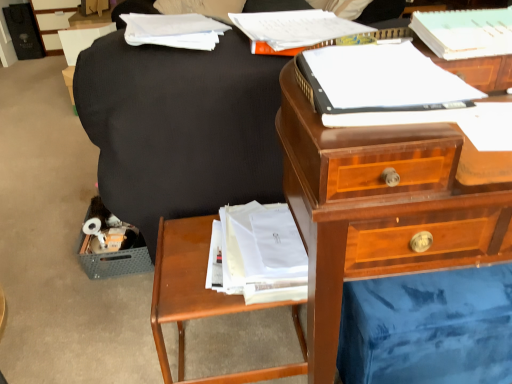
Question: Does point (147, 26) appear closer or farther from the camera than point (47, 6)?

Choices:
 (A) farther
 (B) closer

Answer: (B)

Question: Based on their positions, is white paper at upper left located to the left or right of matte black file cabinet at upper left?

Choices:
 (A) right
 (B) left

Answer: (A)

Question: Which of these objects is positioned closest to the matte black file cabinet at upper left?

Choices:
 (A) matte black swivel chair at center
 (B) light green paper at upper right, the second paperback book in the front-to-back sequence
 (C) wooden nightstand at lower left
 (D) white paper at upper left
 (E) white paper at upper center, marked as the 3th paperback book in a front-to-back arrangement

Answer: (D)

Question: Considering the real-world distances, which object is farthest from the matte black swivel chair at center?

Choices:
 (A) matte black file cabinet at upper left
 (B) white paper at upper center, placed as the 1th paperback book when sorted from back to front
 (C) white paper at upper right, acting as the 1th paperback book starting from the front
 (D) wooden nightstand at lower left
 (E) white paper at upper left

Answer: (A)